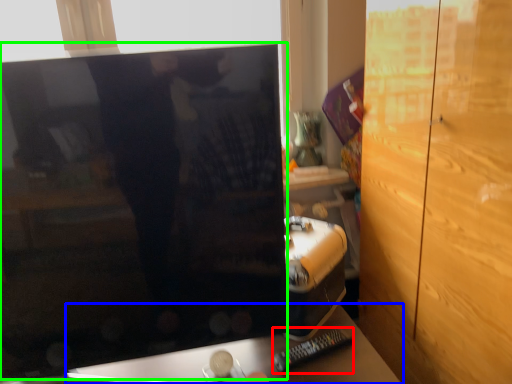
Question: Which object is positioned farthest from remote (highlighted by a red box)? Select from furniture (highlighted by a blue box) and computer monitor (highlighted by a green box).

Choices:
 (A) furniture
 (B) computer monitor

Answer: (B)